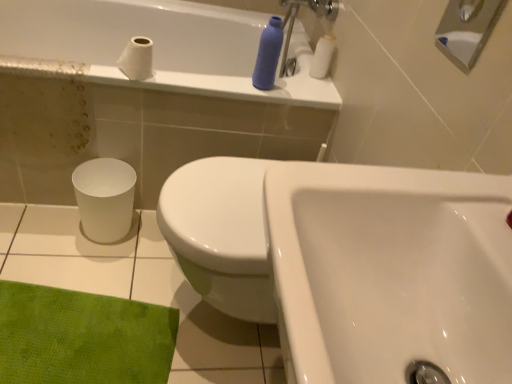
I want to click on vacant space to the right of matte plastic bottle at upper center, so click(298, 93).